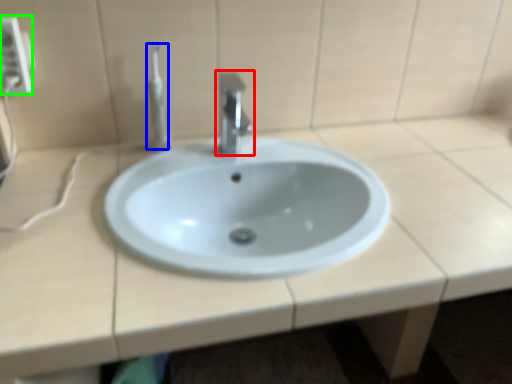
Question: Which object is the closest to the tap (highlighted by a red box)? Choose among these: toothbrush (highlighted by a blue box) or electric outlet (highlighted by a green box).

Choices:
 (A) toothbrush
 (B) electric outlet

Answer: (A)